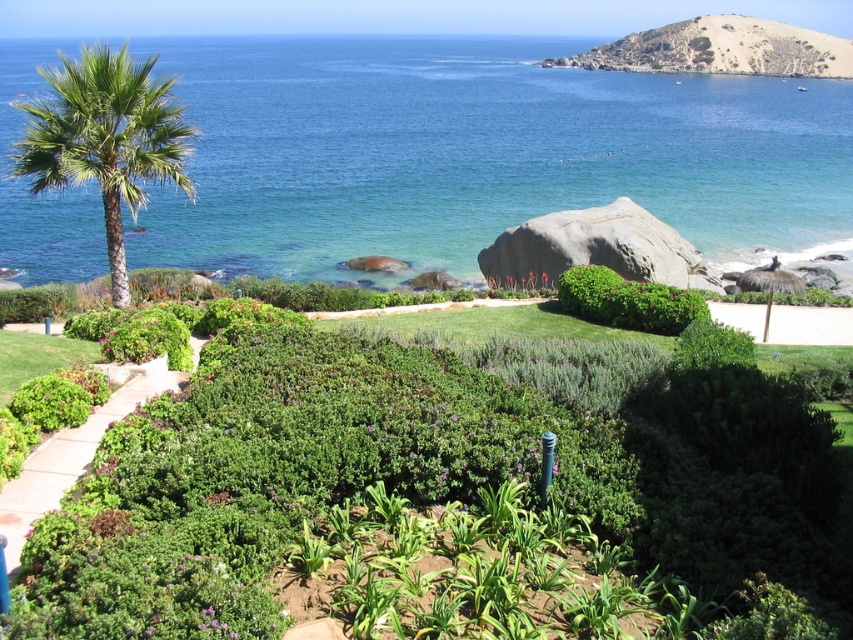
Question: Which object appears closest to the camera in this image?

Choices:
 (A) green grass at lower left
 (B) green leafy bush at center
 (C) green leafy palm tree at left

Answer: (A)

Question: Among these objects, which one is farthest from the camera?

Choices:
 (A) green leafy palm tree at left
 (B) green leafy bush at center
 (C) blue water at upper left

Answer: (C)

Question: Is blue water at upper left wider than green grass at lower left?

Choices:
 (A) yes
 (B) no

Answer: (A)

Question: Estimate the real-world distances between objects in this image. Which object is farther from the green leafy palm tree at left?

Choices:
 (A) green grass at lower left
 (B) blue water at upper left

Answer: (B)

Question: In this image, where is blue water at upper left located relative to green grass at lower left?

Choices:
 (A) right
 (B) left

Answer: (B)

Question: Is blue water at upper left smaller than green leafy bush at center?

Choices:
 (A) no
 (B) yes

Answer: (A)